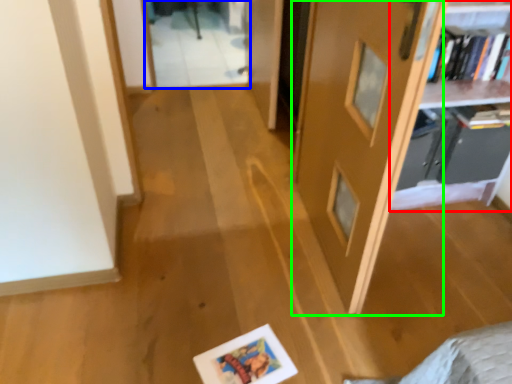
Question: Estimate the real-world distances between objects in this image. Which object is closer to shelf (highlighted by a red box), glass door (highlighted by a blue box) or door (highlighted by a green box)?

Choices:
 (A) glass door
 (B) door

Answer: (B)